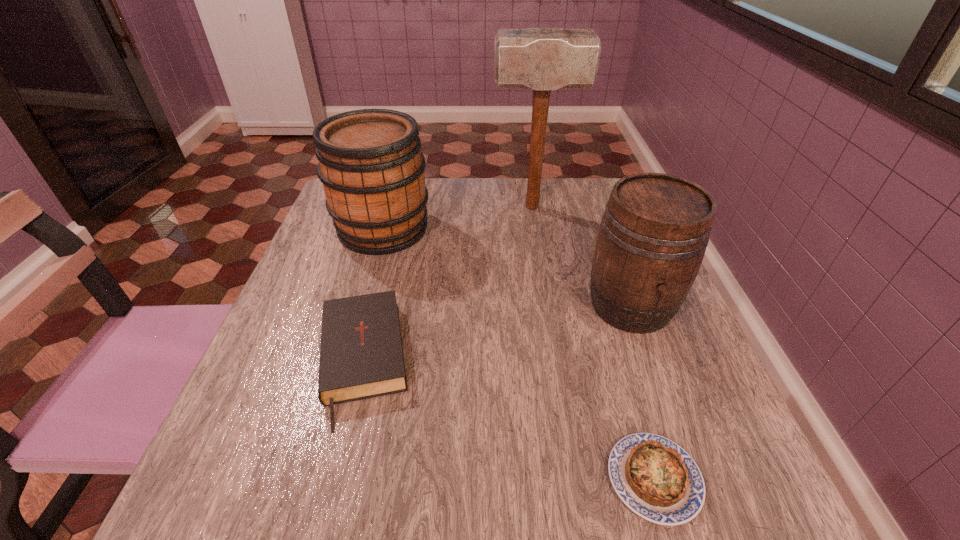
Identify the location of mallet. Image resolution: width=960 pixels, height=540 pixels. (540, 59).

Identify the location of the left cider. This screenshot has height=540, width=960. (370, 163).

At what (x,y) coordinates should I click in order to perform the action: click on the nearer cider. Please return your answer as a coordinate pair (x, y). Image resolution: width=960 pixels, height=540 pixels. Looking at the image, I should click on (652, 238).

Where is `the second shortest object`? the second shortest object is located at coordinates (361, 356).

Locate an element on the screen. the shortest object is located at coordinates (657, 479).

Where is `the nearest object`? The width and height of the screenshot is (960, 540). the nearest object is located at coordinates (657, 479).

You are a GUI agent. You are given a task and a screenshot of the screen. Output one action in this format:
    pyautogui.click(x=<x>, y=<y>)
    Task: Click on the vacant space situated 0.250m on the striking face of the mallet
    
    Given the screenshot: What is the action you would take?
    pyautogui.click(x=397, y=207)

Find the location of a particular element. free region located 0.130m on the striking face of the mallet is located at coordinates (443, 207).

What are the coordinates of `blank area located 0.220m on the striking face of the mallet` in the screenshot? It's located at point(408,207).

At what (x,y) coordinates should I click in order to perform the action: click on vacant area located 0.350m on the right of the left cider. Please return your answer as a coordinate pair (x, y). The height and width of the screenshot is (540, 960). Looking at the image, I should click on (572, 228).